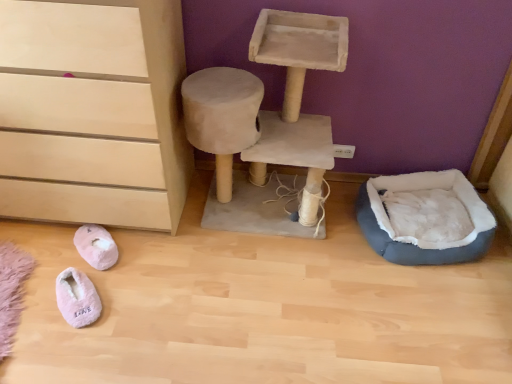
Question: Is gray plush pet bed at lower right facing towards pink fluffy slippers at lower left, arranged as the 2th footwear when viewed from the back?

Choices:
 (A) yes
 (B) no

Answer: (B)

Question: From the image's perspective, would you say gray plush pet bed at lower right is shown under pink fluffy slippers at lower left, which is the first footwear from front to back?

Choices:
 (A) yes
 (B) no

Answer: (B)

Question: Is gray plush pet bed at lower right to the right of pink fluffy slippers at lower left, which is the first footwear from front to back, from the viewer's perspective?

Choices:
 (A) no
 (B) yes

Answer: (B)

Question: From a real-world perspective, is gray plush pet bed at lower right physically below pink fluffy slippers at lower left, which is the first footwear from front to back?

Choices:
 (A) no
 (B) yes

Answer: (A)

Question: From the image's perspective, is gray plush pet bed at lower right on top of pink fluffy slippers at lower left, arranged as the 2th footwear when viewed from the back?

Choices:
 (A) no
 (B) yes

Answer: (B)

Question: Is gray plush pet bed at lower right at the left side of pink fluffy slippers at lower left, arranged as the 2th footwear when viewed from the back?

Choices:
 (A) yes
 (B) no

Answer: (B)

Question: Can you confirm if gray plush pet bed at lower right is bigger than matte wood chest of drawers at lower left?

Choices:
 (A) no
 (B) yes

Answer: (A)

Question: Considering the relative sizes of gray plush pet bed at lower right and matte wood chest of drawers at lower left in the image provided, is gray plush pet bed at lower right shorter than matte wood chest of drawers at lower left?

Choices:
 (A) no
 (B) yes

Answer: (B)

Question: Would you say gray plush pet bed at lower right is a long distance from matte wood chest of drawers at lower left?

Choices:
 (A) yes
 (B) no

Answer: (A)

Question: Is gray plush pet bed at lower right positioned with its back to matte wood chest of drawers at lower left?

Choices:
 (A) no
 (B) yes

Answer: (A)

Question: From the image's perspective, would you say gray plush pet bed at lower right is positioned over matte wood chest of drawers at lower left?

Choices:
 (A) yes
 (B) no

Answer: (B)

Question: Considering the relative sizes of gray plush pet bed at lower right and matte wood chest of drawers at lower left in the image provided, is gray plush pet bed at lower right thinner than matte wood chest of drawers at lower left?

Choices:
 (A) yes
 (B) no

Answer: (A)

Question: Is gray plush pet bed at lower right facing away from pink fuzzy slippers at lower left, the second footwear in the front-to-back sequence?

Choices:
 (A) no
 (B) yes

Answer: (A)